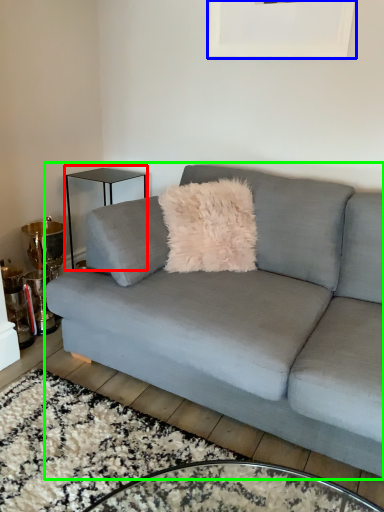
Question: Which object is positioned closest to table (highlighted by a red box)? Select from picture frame (highlighted by a blue box) and studio couch (highlighted by a green box).

Choices:
 (A) picture frame
 (B) studio couch

Answer: (A)